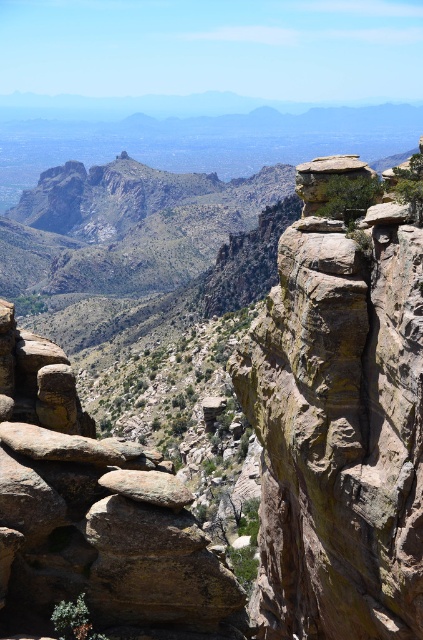
You are standing at the point marked by the coordinates point (338, 420) in the image. What is the dominant color of the terrain you are currently standing on?

The dominant color of the terrain at point (338, 420) is rusty brown rock at upper center.

You are a hiker planning to take a photo of the rusty brown rock at upper center and the rusty rock formation at center. Which one should you focus on first to ensure both are in the frame?

You should focus on the rusty brown rock at upper center first because it is closer to you than the rusty rock formation at center, so adjusting focus from near to far will help capture both in the frame.

You are a geologist examining the mountainous landscape. You need to compare the sizes of the rusty brown rock at upper center and the rusty rock formation at center. Which one is wider?

The rusty brown rock at upper center is less wide than the rusty rock formation at center, so the rusty rock formation at center is wider.